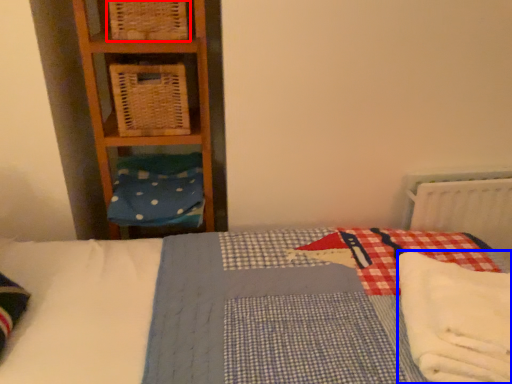
Question: Which of the following is the closest to the observer, crate (highlighted by a red box) or material (highlighted by a blue box)?

Choices:
 (A) crate
 (B) material

Answer: (B)